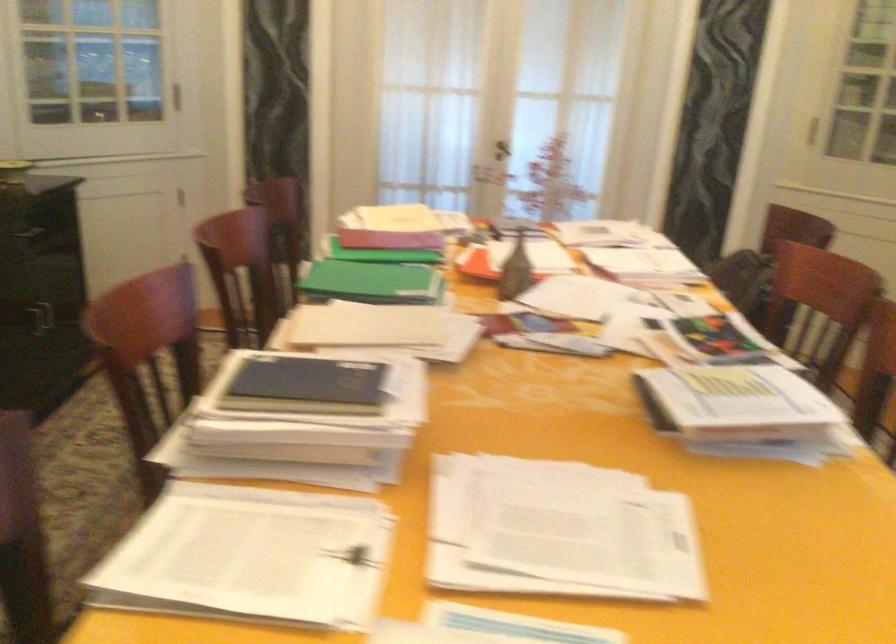
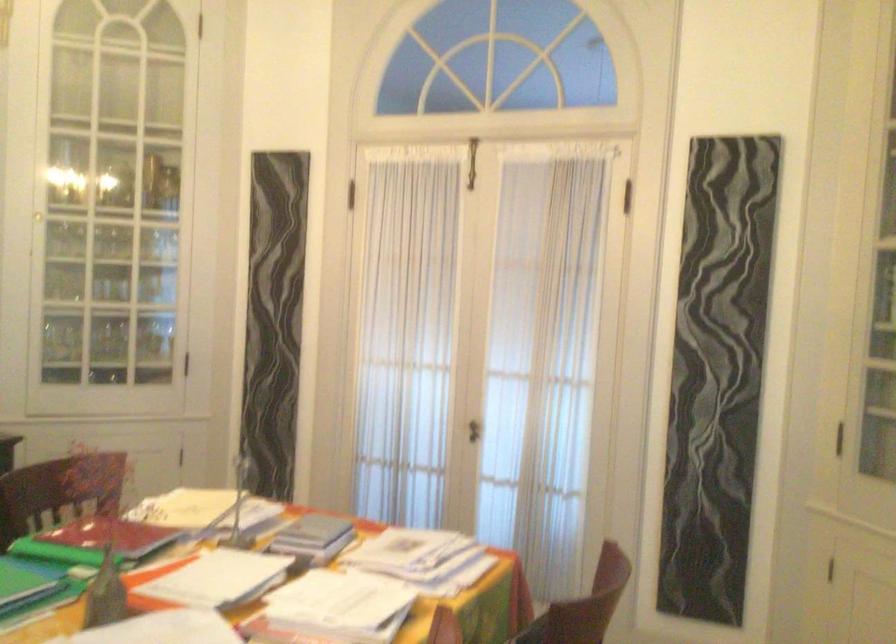
What movement of the cameraman would produce the second image?

The cameraman moved toward right, forward.